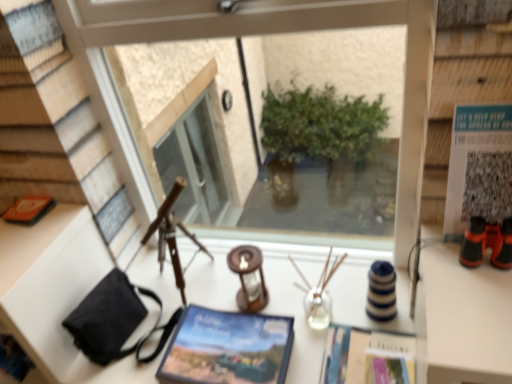
Where is `vacant position to the left of white paper at upper right`? This screenshot has height=384, width=512. vacant position to the left of white paper at upper right is located at coordinates (438, 270).